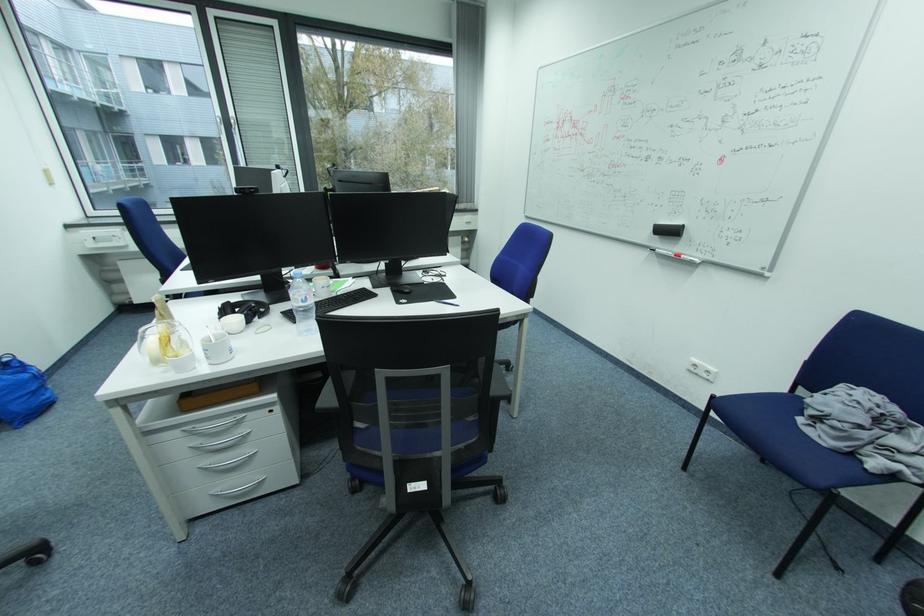
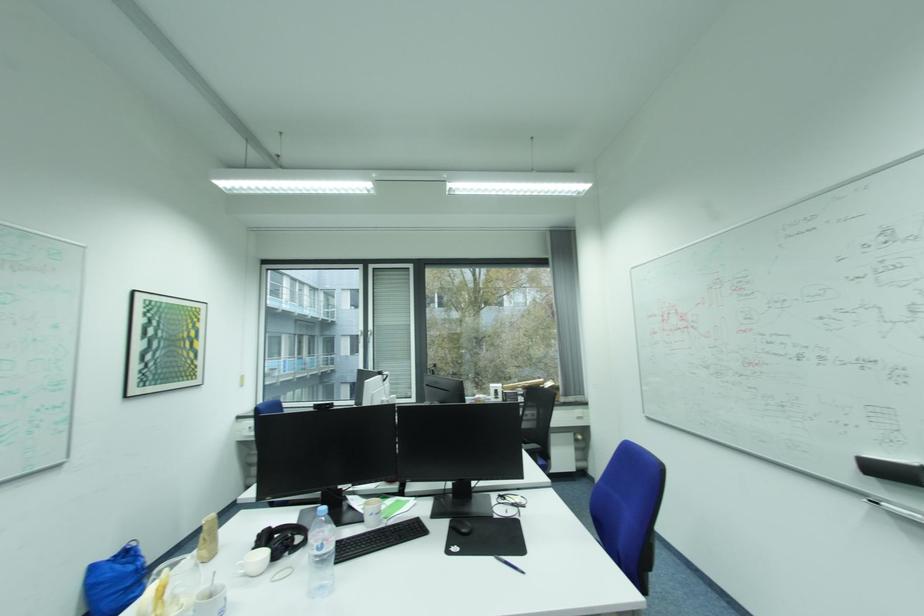
In the second image, find the point that corresponds to (259,313) in the first image.

(287, 546)